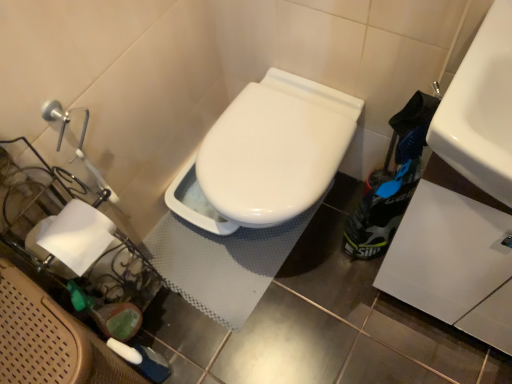
Locate an element on the screen. The height and width of the screenshot is (384, 512). empty space that is ontop of white textured bath mat at center (from a real-world perspective) is located at coordinates (211, 257).